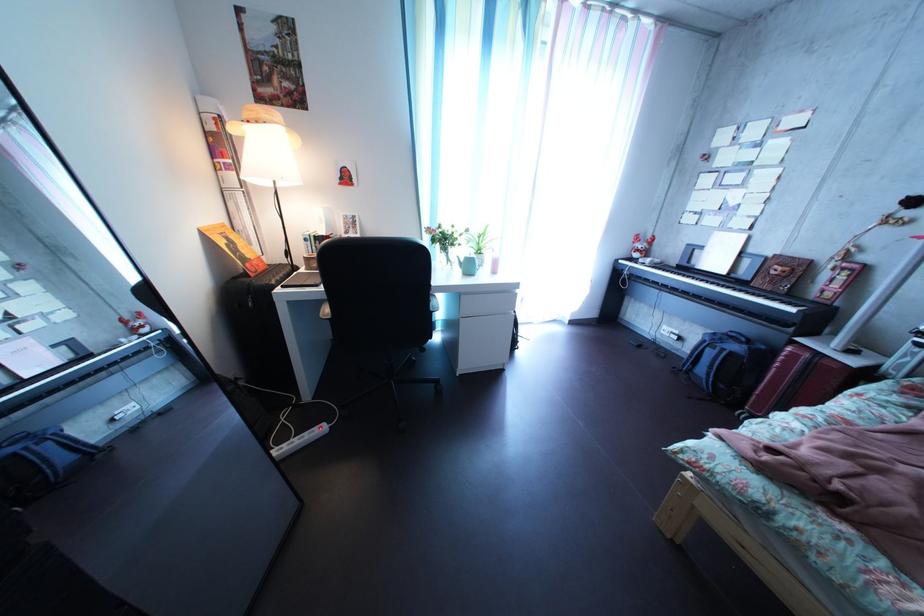
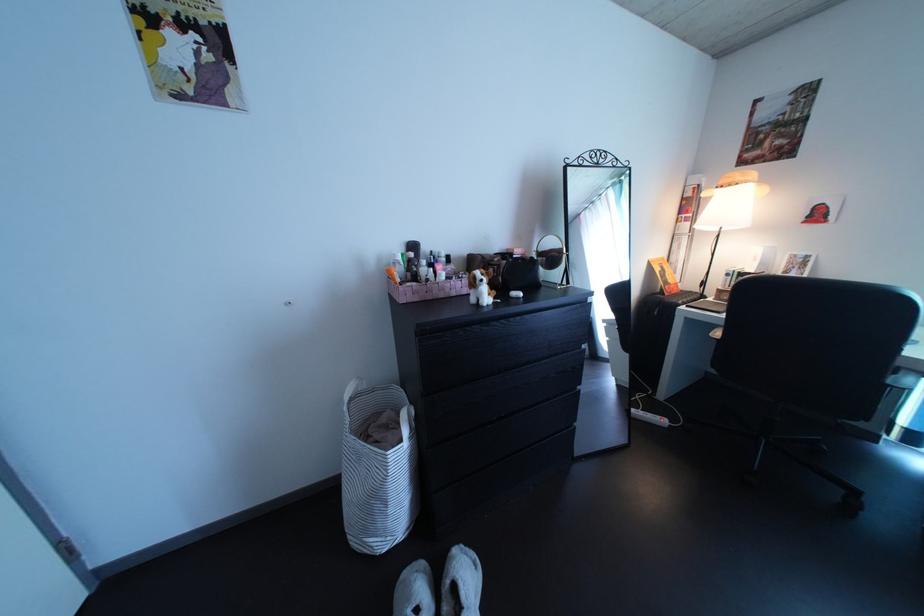
Where in the second image is the point corresponding to pixel 246 138 from the first image?

(719, 203)